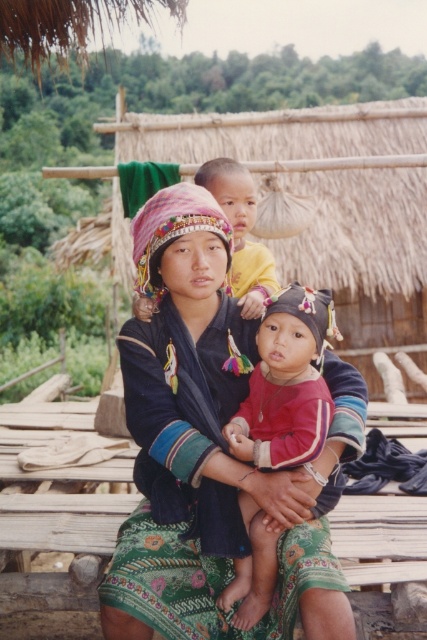
Question: Is embroidered fabric dress at center further to the viewer compared to matte red shirt at center?

Choices:
 (A) yes
 (B) no

Answer: (B)

Question: Which of these objects is positioned farthest from the matte yellow shirt at center?

Choices:
 (A) embroidered fabric dress at center
 (B) matte red shirt at center

Answer: (B)

Question: Can you confirm if matte red shirt at center is positioned below matte yellow shirt at center?

Choices:
 (A) no
 (B) yes

Answer: (B)

Question: Which of the following is the closest to the observer?

Choices:
 (A) matte yellow shirt at center
 (B) matte red shirt at center

Answer: (B)

Question: Which of the following is the farthest from the observer?

Choices:
 (A) embroidered fabric dress at center
 (B) matte yellow shirt at center
 (C) matte red shirt at center

Answer: (B)

Question: Can you confirm if embroidered fabric dress at center is smaller than matte red shirt at center?

Choices:
 (A) no
 (B) yes

Answer: (A)